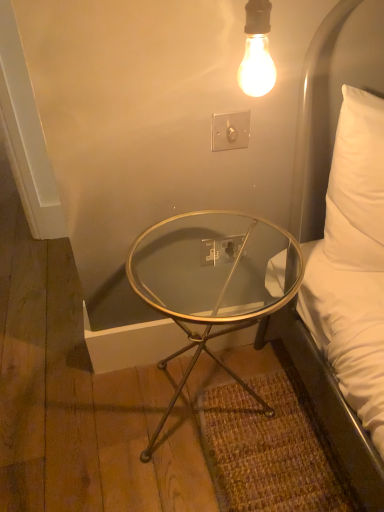
The image size is (384, 512). In order to click on free space underneath clear glass table at lower center (from a real-world perspective) in this screenshot , I will do `click(204, 403)`.